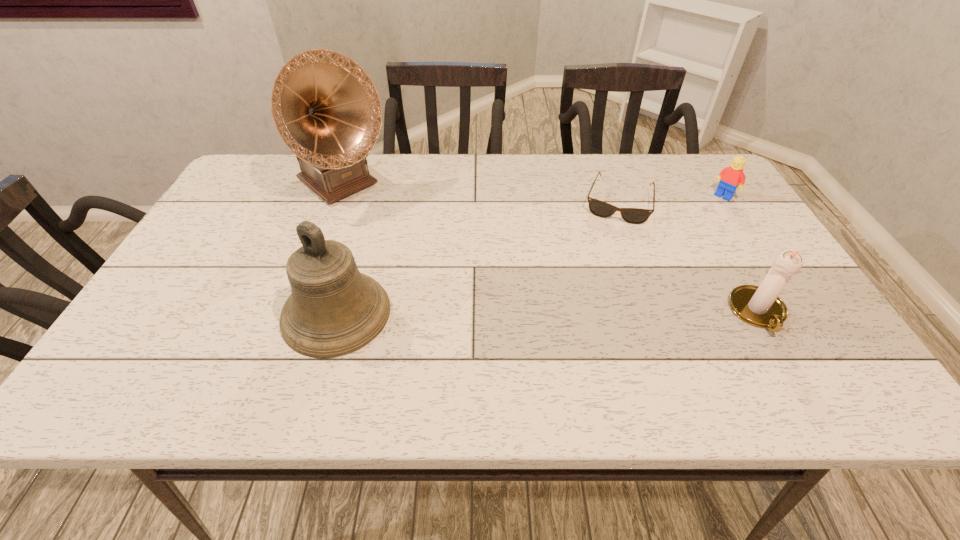
Find the location of `free location at the right edge of the desktop`. free location at the right edge of the desktop is located at coordinates (710, 257).

The height and width of the screenshot is (540, 960). What are the coordinates of `free spot at the far left corner of the desktop` in the screenshot? It's located at (282, 178).

At what (x,y) coordinates should I click in order to perform the action: click on vacant point located between the bell and the Lego. Please return your answer as a coordinate pair (x, y). Looking at the image, I should click on (530, 255).

Locate an element on the screen. This screenshot has height=540, width=960. vacant space that's between the rightmost object and the second object from right to left is located at coordinates (740, 254).

Where is `vacant point located between the bell and the shortest object`? This screenshot has height=540, width=960. vacant point located between the bell and the shortest object is located at coordinates (477, 258).

This screenshot has height=540, width=960. Find the location of `free space between the Lego and the third shortest object`. free space between the Lego and the third shortest object is located at coordinates (740, 254).

In order to click on unoccupied area between the Lego and the sunglasses in this screenshot , I will do `click(671, 199)`.

I want to click on unoccupied area between the third object from right to left and the tallest object, so click(480, 194).

Image resolution: width=960 pixels, height=540 pixels. Identify the location of free area in between the phonograph record and the shortest object. (480, 194).

The height and width of the screenshot is (540, 960). In order to click on empty location between the sunglasses and the fourth shortest object in this screenshot , I will do `click(477, 258)`.